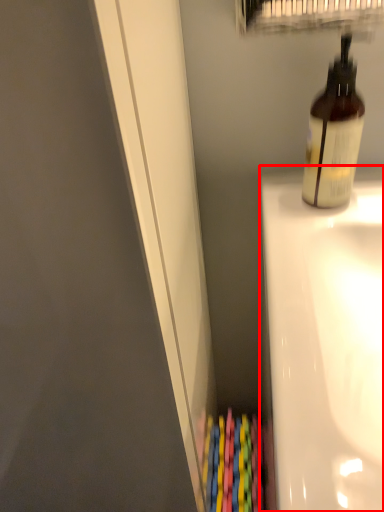
Question: From the image's perspective, what is the correct spatial relationship of bath (annotated by the red box) in relation to bottle?

Choices:
 (A) above
 (B) below

Answer: (B)